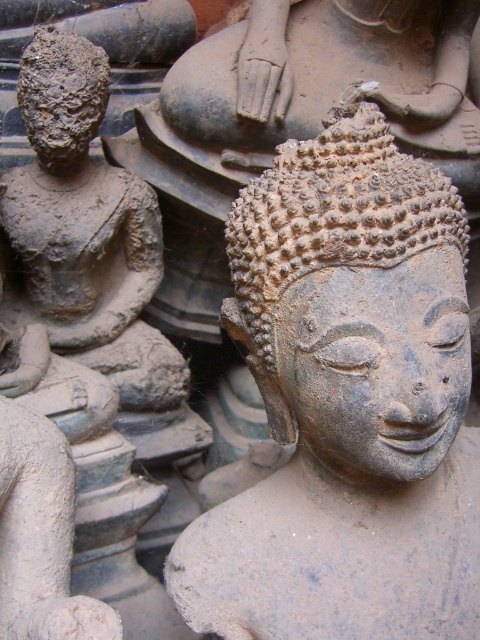
Where is `matte stone head at center`? This screenshot has height=640, width=480. matte stone head at center is located at coordinates (328, 227).

Which is in front, point (300, 177) or point (40, 48)?

Point (300, 177) is more forward.

The image size is (480, 640). Identify the location of matte stone head at center. (328, 227).